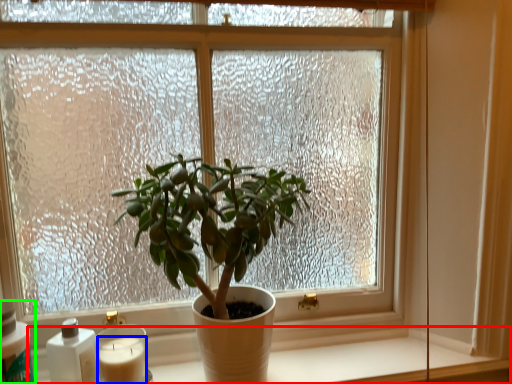
Question: Which object is the farthest from window sill (highlighted by a red box)? Choose among these: candle (highlighted by a blue box) or bottle (highlighted by a green box).

Choices:
 (A) candle
 (B) bottle

Answer: (B)